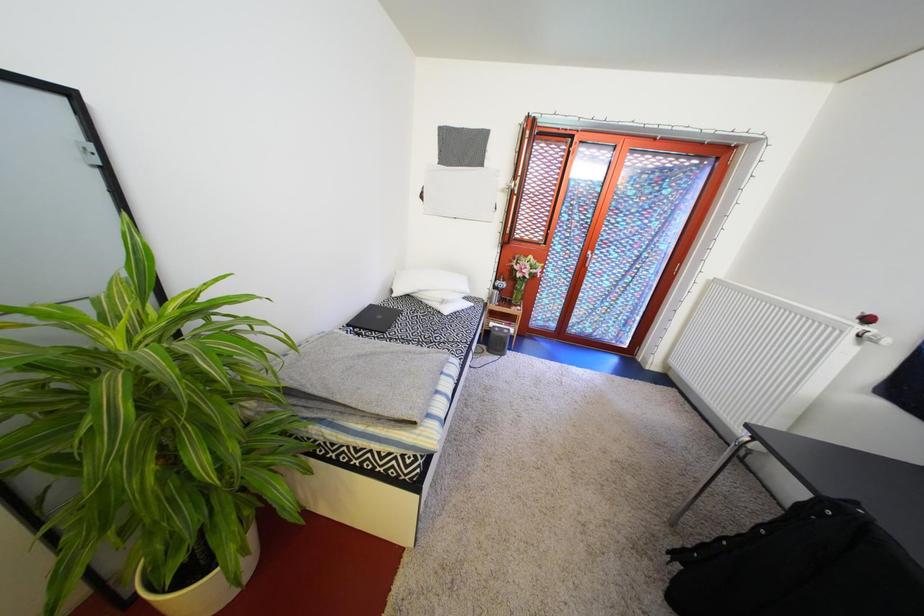
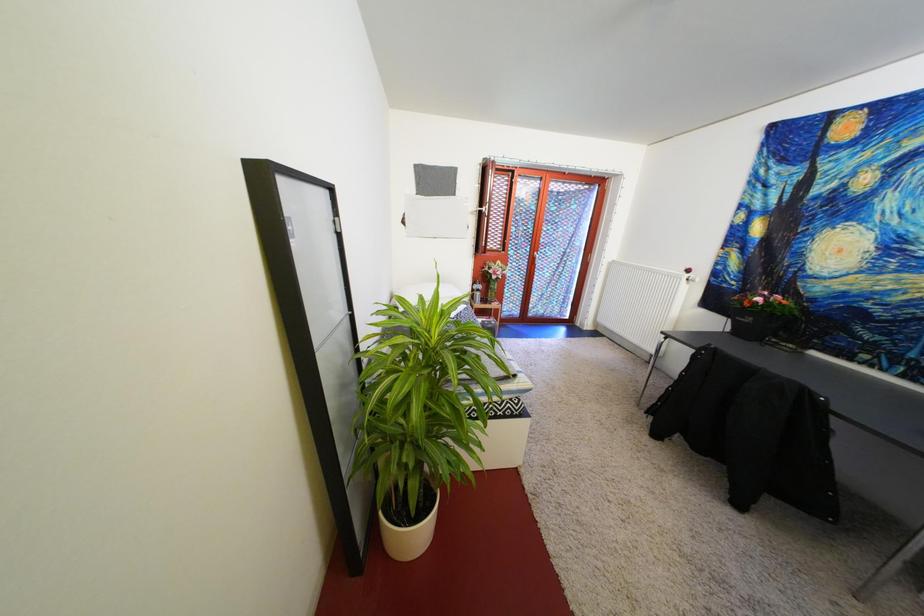
The images are taken continuously from a first-person perspective. In which direction are you moving?

The cameraman moved toward left, backward.